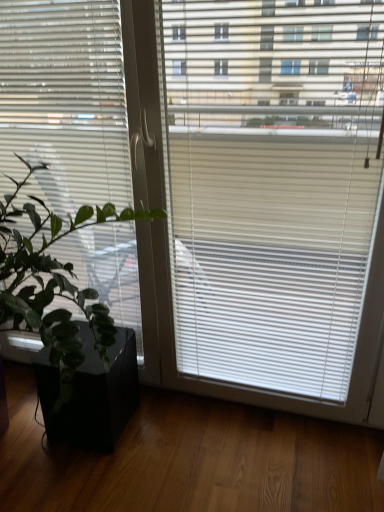
At what (x,y) coordinates should I click in order to perform the action: click on vacant region in front of white matte window blind at left. Please return your answer as a coordinate pair (x, y). Looking at the image, I should click on (83, 472).